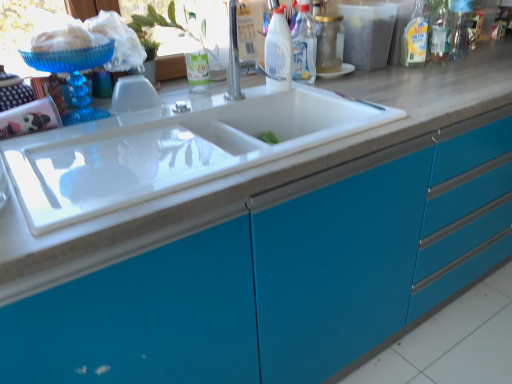
Image resolution: width=512 pixels, height=384 pixels. Find the location of `vacant point to the left of clear plastic bottle at upper right`. vacant point to the left of clear plastic bottle at upper right is located at coordinates (382, 74).